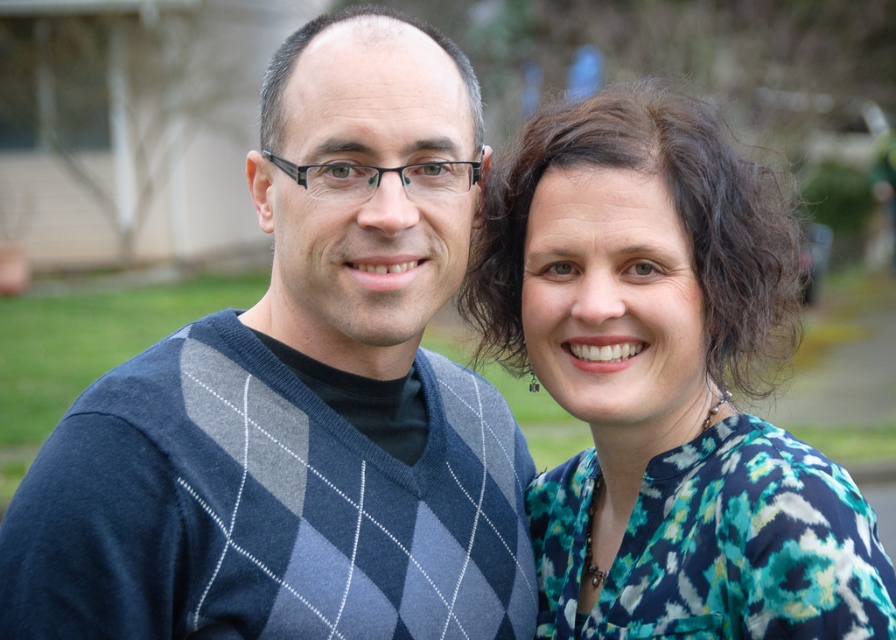
Which is behind, point (382, 170) or point (643, 484)?

Positioned behind is point (643, 484).

Image resolution: width=896 pixels, height=640 pixels. What are the coordinates of `argyle sweater at center` in the screenshot? It's located at (302, 397).